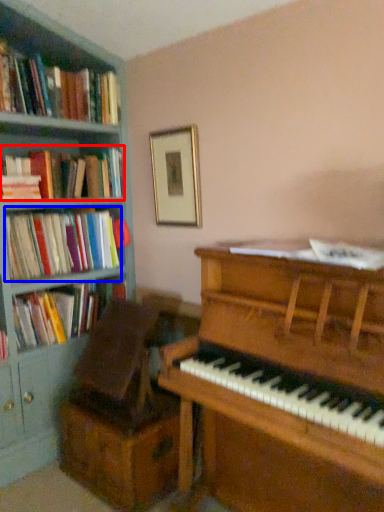
Question: Which point is closer to the camera, book (highlighted by a red box) or book (highlighted by a blue box)?

Choices:
 (A) book
 (B) book

Answer: (A)